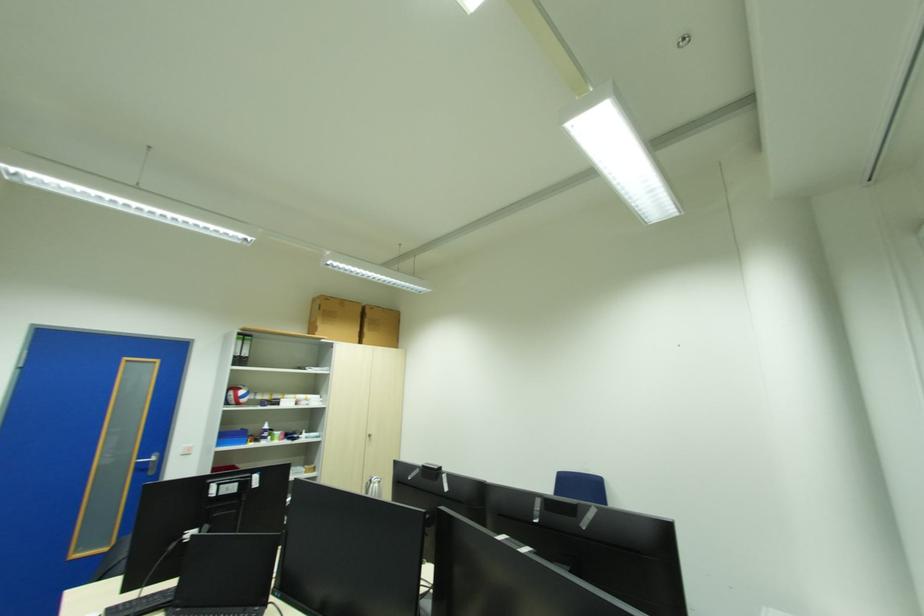
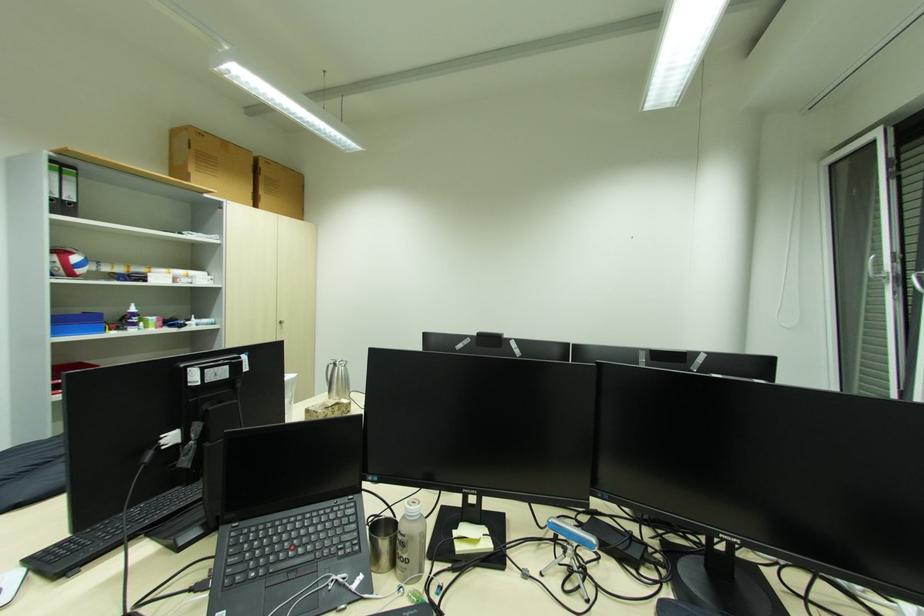
First-person continuous shooting, in which direction is the camera rotating?

The camera rotated toward right-down.